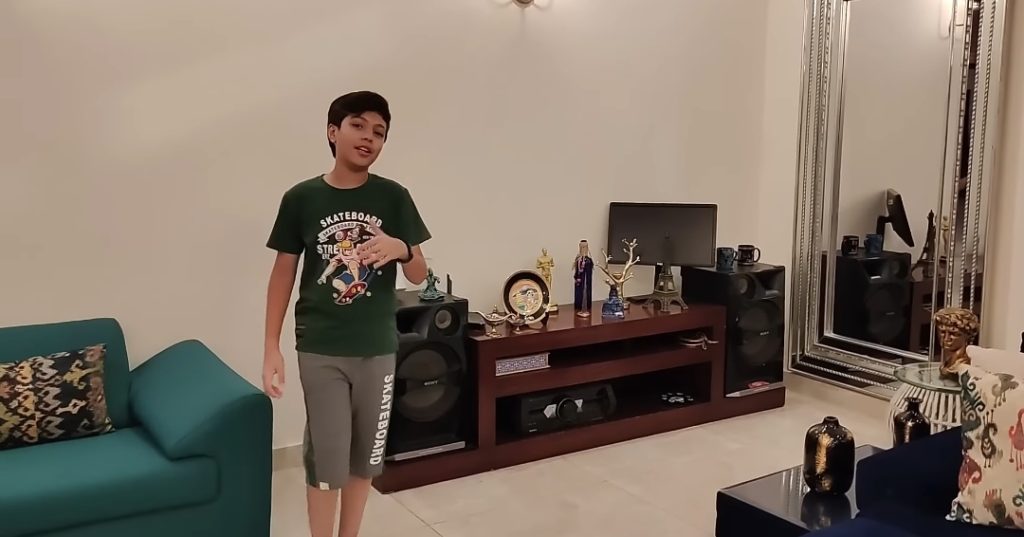
Where is `gold urn`? This screenshot has width=1024, height=537. gold urn is located at coordinates coord(848,457).